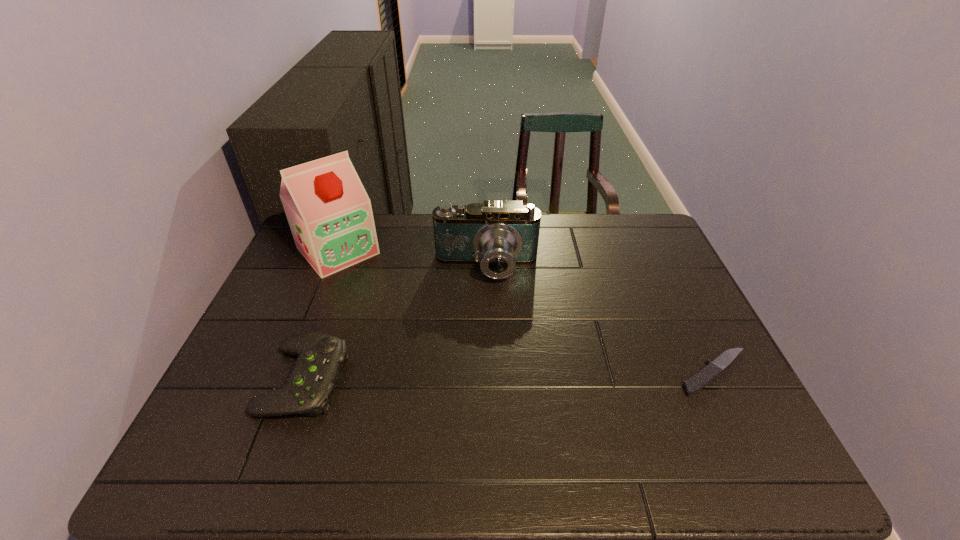
This screenshot has height=540, width=960. I want to click on control, so click(316, 371).

Find the location of `the rightmost object`. the rightmost object is located at coordinates (701, 379).

Locate an element on the screen. The image size is (960, 540). steak knife is located at coordinates (701, 379).

Locate an element on the screen. the tallest object is located at coordinates (330, 216).

Find the location of a particular element. The height and width of the screenshot is (540, 960). the third shortest object is located at coordinates coord(499,235).

At what (x,y) coordinates should I click in order to perform the action: click on camcorder. Please return your answer as a coordinate pair (x, y). Looking at the image, I should click on (499, 235).

This screenshot has height=540, width=960. What are the coordinates of `blank area located on the right of the second shortest object` in the screenshot? It's located at (374, 380).

What are the coordinates of `vacant region located on the left of the rightmost object` in the screenshot? It's located at (517, 373).

At what (x,y) coordinates should I click in order to perform the action: click on free space located with the cap open on the tallest object. Please return your answer as a coordinate pair (x, y). This screenshot has width=960, height=540. Looking at the image, I should click on (367, 282).

In order to click on vacant position located 0.190m with the cap open on the tallest object in this screenshot , I will do `click(390, 307)`.